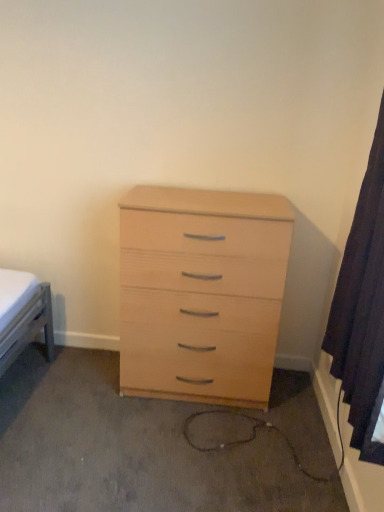
Identify the location of free point above light wood chest of drawers at center (from a real-world perspective). point(186,198).